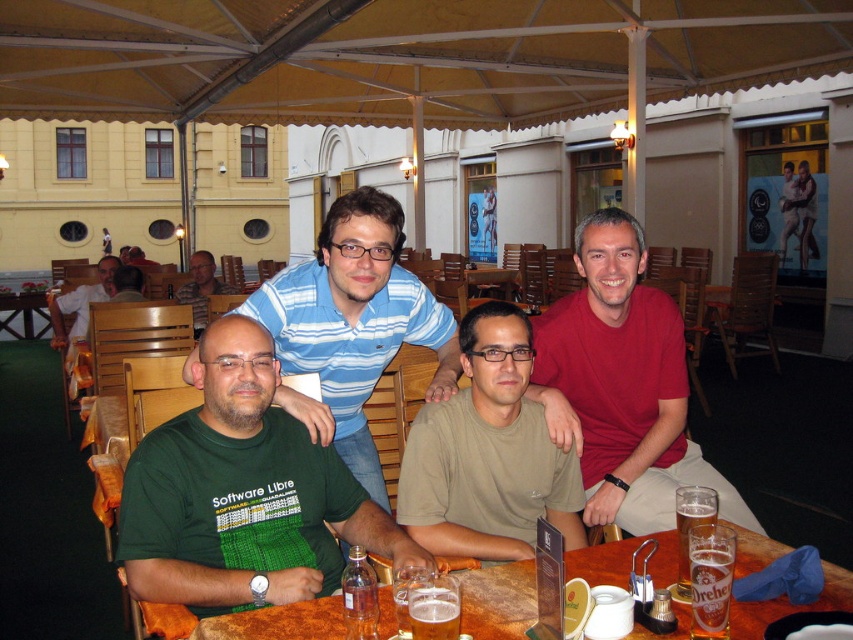
Can you confirm if green jersey at center is smaller than matte blue shirt at center?

Yes, green jersey at center is smaller than matte blue shirt at center.

Locate an element on the screen. The height and width of the screenshot is (640, 853). green jersey at center is located at coordinates (242, 493).

Between point (241, 580) and point (198, 276), which one is positioned in front?

Positioned in front is point (241, 580).

At what (x,y) coordinates should I click in order to perform the action: click on green jersey at center. Please return your answer as a coordinate pair (x, y). The height and width of the screenshot is (640, 853). Looking at the image, I should click on (242, 493).

Is translucent glass beer at table center smaller than matte blue shirt at center?

Yes, translucent glass beer at table center is smaller than matte blue shirt at center.

Which is more to the left, translucent glass beer at table center or matte blue shirt at center?

From the viewer's perspective, matte blue shirt at center appears more on the left side.

Does point (453, 630) come closer to viewer compared to point (210, 266)?

Yes, it is in front of point (210, 266).

Where is `translucent glass beer at table center`? This screenshot has width=853, height=640. translucent glass beer at table center is located at coordinates (434, 612).

Who is more distant from viewer, (705, 544) or (688, 531)?

The point (688, 531) is more distant.

Where is `amber glass beer at table center`? The height and width of the screenshot is (640, 853). amber glass beer at table center is located at coordinates (711, 588).